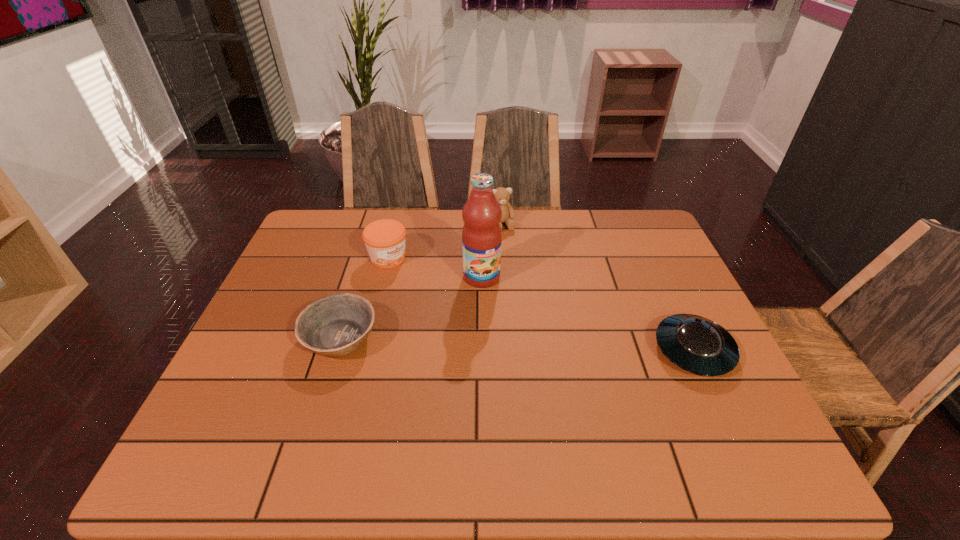
Where is `vacant space located 0.130m on the front label of the tallest object`? The image size is (960, 540). vacant space located 0.130m on the front label of the tallest object is located at coordinates (505, 321).

This screenshot has height=540, width=960. What are the coordinates of `free location located on the front label of the third shortest object` in the screenshot? It's located at (459, 308).

The image size is (960, 540). In order to click on vacant space located on the front label of the third shortest object in this screenshot , I will do `click(492, 331)`.

Find the location of `vacant region located 0.340m on the front label of the third shortest object`. vacant region located 0.340m on the front label of the third shortest object is located at coordinates (487, 327).

Where is `free space located 0.380m on the face of the farthest object`? This screenshot has width=960, height=540. free space located 0.380m on the face of the farthest object is located at coordinates (542, 316).

You are a GUI agent. You are given a task and a screenshot of the screen. Output one action in this format:
    pyautogui.click(x=<x>, y=<y>)
    Task: Click on the free spot located 0.360m on the face of the farthest object
    This screenshot has height=540, width=960.
    Given the screenshot: What is the action you would take?
    pos(540,311)

In order to click on free region located 0.060m on the face of the farthest object in this screenshot , I will do `click(510, 244)`.

Find the location of a particular element. The height and width of the screenshot is (540, 960). jam that is at the far edge is located at coordinates (385, 239).

At what (x,y) coordinates should I click in order to perform the action: click on teddy bear located in the far edge section of the desktop. Please return your answer as a coordinate pair (x, y). This screenshot has height=540, width=960. Looking at the image, I should click on (502, 194).

Identify the location of object present at the left edge. The image size is (960, 540). [x=335, y=326].